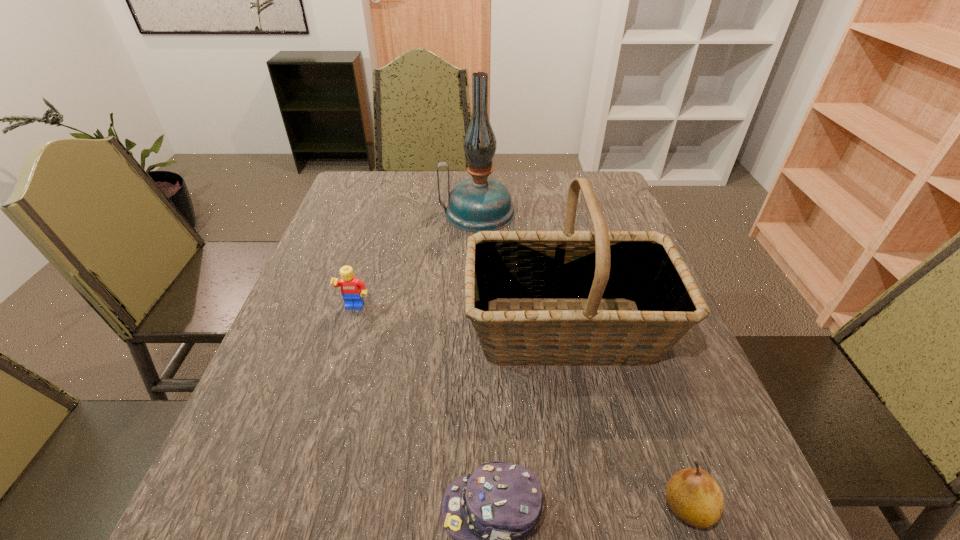
Where is `free region at the right edge of the desktop`? Image resolution: width=960 pixels, height=540 pixels. free region at the right edge of the desktop is located at coordinates (705, 396).

This screenshot has height=540, width=960. In order to click on free space at the far right corner of the desktop in this screenshot , I will do coord(566,180).

Find the location of a particular element. This screenshot has width=960, height=540. free location at the near right corner is located at coordinates (x=728, y=501).

The height and width of the screenshot is (540, 960). In order to click on vacant point located between the leftmost object and the pear in this screenshot , I will do `click(521, 408)`.

This screenshot has width=960, height=540. Identify the location of free space between the pear and the Lego. (521, 408).

Where is `free space between the pear and the leftmost object`? This screenshot has width=960, height=540. free space between the pear and the leftmost object is located at coordinates (521, 408).

This screenshot has height=540, width=960. Identify the location of object that is the fourth closest to the headwear. (479, 203).

Image resolution: width=960 pixels, height=540 pixels. In order to click on object that is the second closest to the basket in this screenshot , I will do `click(692, 495)`.

Find the location of a particular element. The width and height of the screenshot is (960, 540). vacant area in the image that satisfies the following two spatial constraints: 1. on the face of the leftmost object; 2. on the left side of the pear is located at coordinates (296, 508).